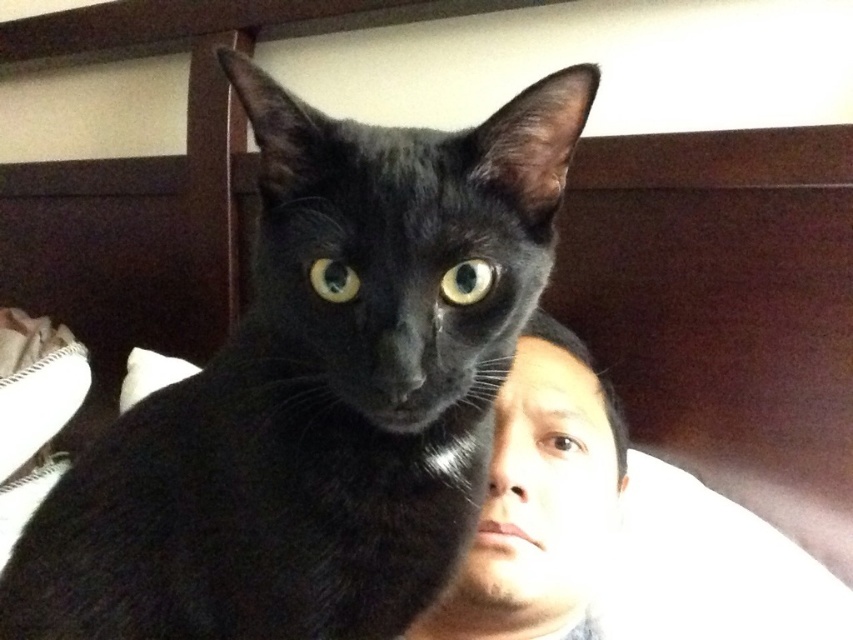
Which is above, black glossy cat at center or smooth skin face at center?

Positioned higher is black glossy cat at center.

Does black glossy cat at center appear on the left side of smooth skin face at center?

Correct, you'll find black glossy cat at center to the left of smooth skin face at center.

The height and width of the screenshot is (640, 853). Find the location of `black glossy cat at center`. black glossy cat at center is located at coordinates (318, 392).

The height and width of the screenshot is (640, 853). I want to click on black glossy cat at center, so pyautogui.click(x=318, y=392).